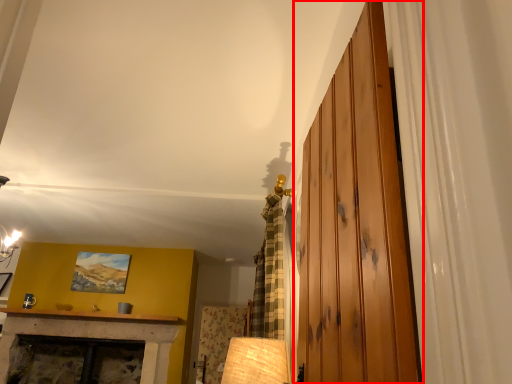
Question: From the image's perspective, what is the correct spatial relationship of barn door (annotated by the red box) in relation to picture frame?

Choices:
 (A) above
 (B) below

Answer: (A)